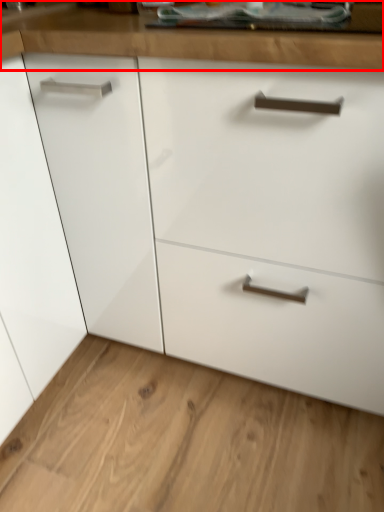
Question: From the image's perspective, where is counter top (annotated by the red box) located relative to plain?

Choices:
 (A) above
 (B) below

Answer: (A)